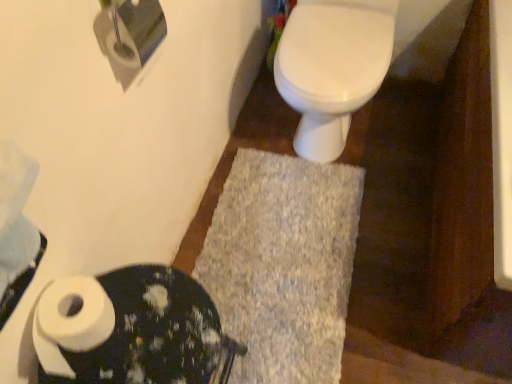
Question: Is point (350, 9) closer or farther from the camera than point (309, 289)?

Choices:
 (A) farther
 (B) closer

Answer: (A)

Question: Is white glossy toilet at center taller or shorter than gray shaggy bath mat at center?

Choices:
 (A) short
 (B) tall

Answer: (B)

Question: Which object is the closest to the white glossy toilet at center?

Choices:
 (A) white matte toilet paper at lower left
 (B) gray shaggy bath mat at center
 (C) white matte toilet paper at upper left, which is counted as the 2th toilet paper, starting from the bottom
 (D) white matte toilet paper at lower left, which is the 2th toilet paper from top to bottom

Answer: (B)

Question: Which object is positioned closest to the white matte toilet paper at lower left?

Choices:
 (A) white glossy toilet at center
 (B) white matte toilet paper at upper left, which is counted as the 2th toilet paper, starting from the bottom
 (C) gray shaggy bath mat at center
 (D) white matte toilet paper at lower left, which is the 2th toilet paper from top to bottom

Answer: (D)